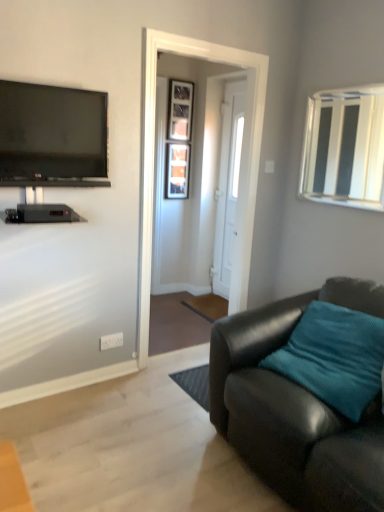
Locate an element on the screen. The image size is (384, 512). free point above white plastic window at upper right, which is the 2th window from left to right (from a real-world perspective) is located at coordinates (360, 79).